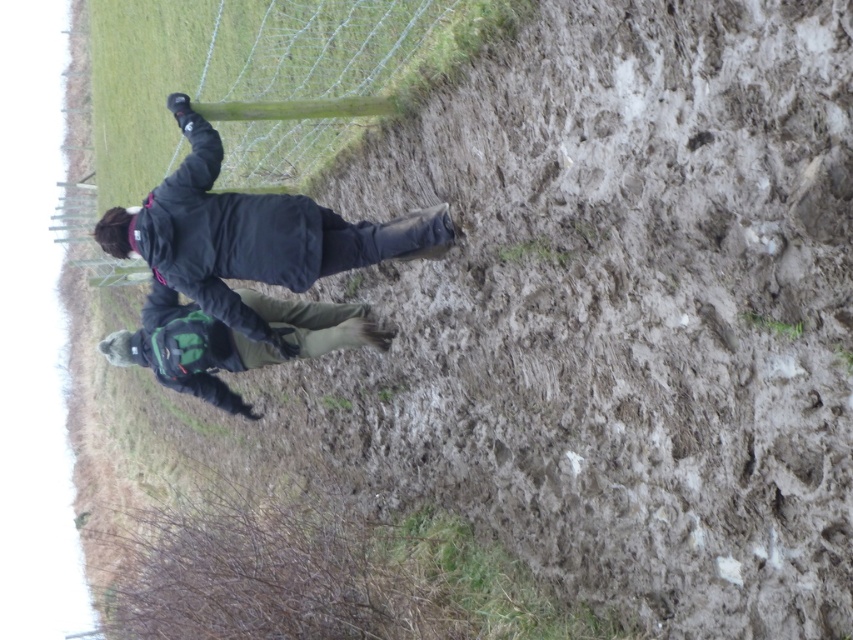
Does dark gray fabric jacket at center have a greater height compared to dark green fabric jacket at center?

Indeed, dark gray fabric jacket at center has a greater height compared to dark green fabric jacket at center.

What do you see at coordinates (250, 234) in the screenshot?
I see `dark gray fabric jacket at center` at bounding box center [250, 234].

Identify the location of dark gray fabric jacket at center. (250, 234).